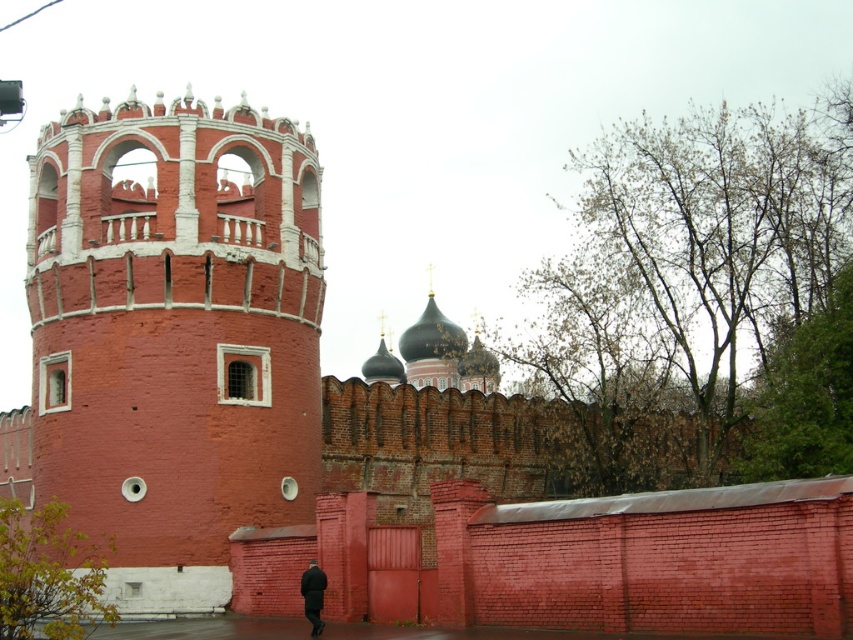
Question: Is smooth brick tower at center thinner than black matte coat at lower center?

Choices:
 (A) no
 (B) yes

Answer: (A)

Question: Can you confirm if smooth brick tower at center is positioned to the right of black matte coat at lower center?

Choices:
 (A) no
 (B) yes

Answer: (A)

Question: Which point appears closest to the camera in this image?

Choices:
 (A) (213, 580)
 (B) (316, 570)

Answer: (B)

Question: Among these points, which one is nearest to the camera?

Choices:
 (A) (320, 634)
 (B) (115, 340)

Answer: (A)

Question: Is smooth brick tower at center to the left of black matte coat at lower center from the viewer's perspective?

Choices:
 (A) no
 (B) yes

Answer: (B)